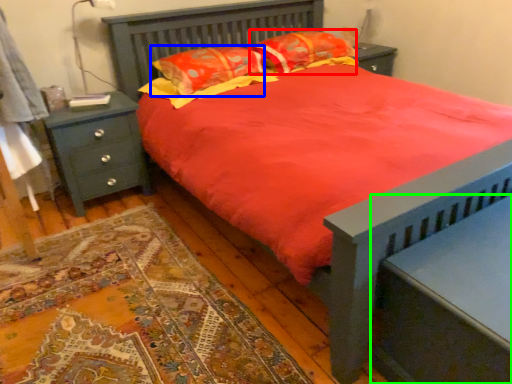
Question: Based on their relative distances, which object is nearer to pillow (highlighted by a red box)? Choose from pillow (highlighted by a blue box) and nightstand (highlighted by a green box).

Choices:
 (A) pillow
 (B) nightstand

Answer: (A)